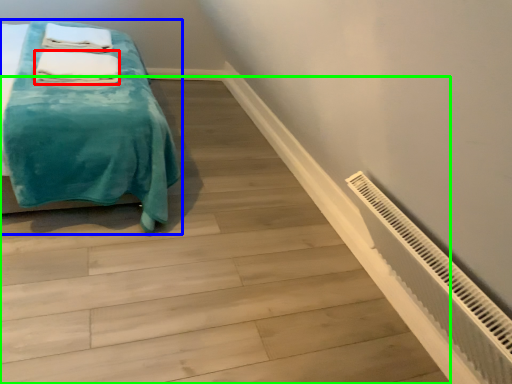
Question: Which object is the closest to the bath towel (highlighted by a red box)? Choose among these: bed (highlighted by a blue box) or stairwell (highlighted by a green box).

Choices:
 (A) bed
 (B) stairwell

Answer: (A)